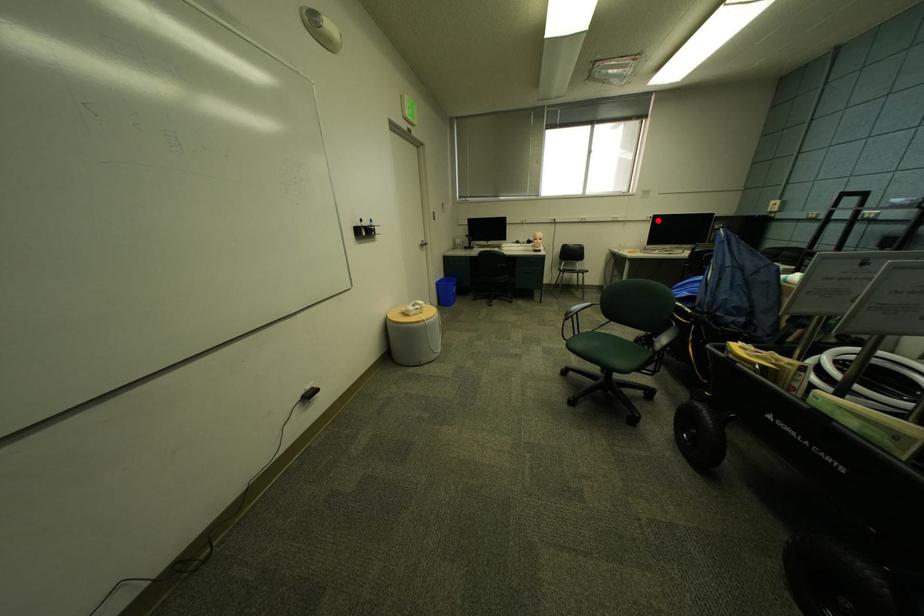
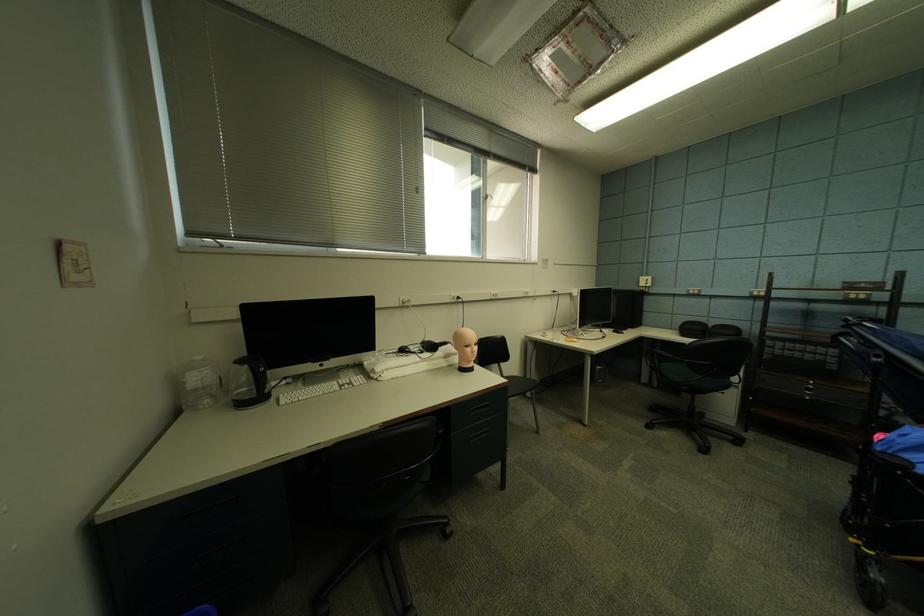
Locate, in the second image, the point that corresponds to the highlighted location in the first image.

(561, 294)